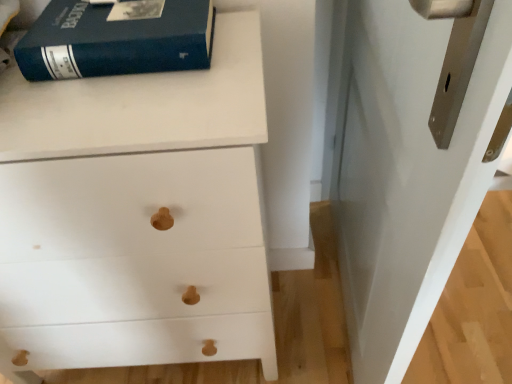
Question: Is white matte wood chest of drawers at upper left shorter than matte blue book at upper left?

Choices:
 (A) yes
 (B) no

Answer: (B)

Question: From a real-world perspective, is white matte wood chest of drawers at upper left on top of matte blue book at upper left?

Choices:
 (A) no
 (B) yes

Answer: (A)

Question: From the image's perspective, is white matte wood chest of drawers at upper left on top of matte blue book at upper left?

Choices:
 (A) no
 (B) yes

Answer: (A)

Question: Is white matte wood chest of drawers at upper left positioned with its back to matte blue book at upper left?

Choices:
 (A) yes
 (B) no

Answer: (B)

Question: Does white matte wood chest of drawers at upper left come in front of matte blue book at upper left?

Choices:
 (A) no
 (B) yes

Answer: (B)

Question: Can you confirm if white matte wood chest of drawers at upper left is wider than matte blue book at upper left?

Choices:
 (A) yes
 (B) no

Answer: (A)

Question: Can you confirm if matte blue book at upper left is positioned to the right of white glossy door at upper right?

Choices:
 (A) no
 (B) yes

Answer: (A)

Question: Considering the relative sizes of matte blue book at upper left and white glossy door at upper right in the image provided, is matte blue book at upper left wider than white glossy door at upper right?

Choices:
 (A) yes
 (B) no

Answer: (A)

Question: Does matte blue book at upper left turn towards white glossy door at upper right?

Choices:
 (A) yes
 (B) no

Answer: (B)

Question: Does matte blue book at upper left have a lesser width compared to white glossy door at upper right?

Choices:
 (A) yes
 (B) no

Answer: (B)

Question: Does matte blue book at upper left have a greater height compared to white glossy door at upper right?

Choices:
 (A) no
 (B) yes

Answer: (A)

Question: Is matte blue book at upper left positioned before white glossy door at upper right?

Choices:
 (A) yes
 (B) no

Answer: (B)

Question: Is white matte wood chest of drawers at upper left positioned with its back to white glossy door at upper right?

Choices:
 (A) yes
 (B) no

Answer: (B)